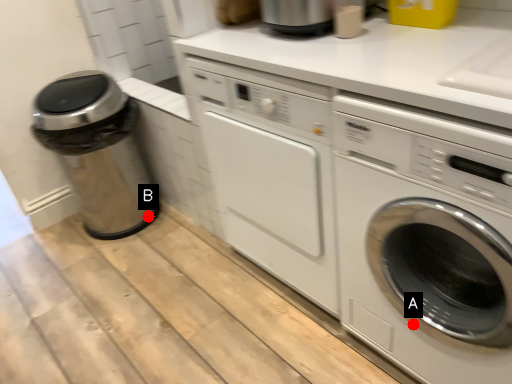
Question: Two points are circled on the image, labeled by A and B beside each circle. Which point appears farthest from the camera in this image?

Choices:
 (A) A is further
 (B) B is further

Answer: (B)